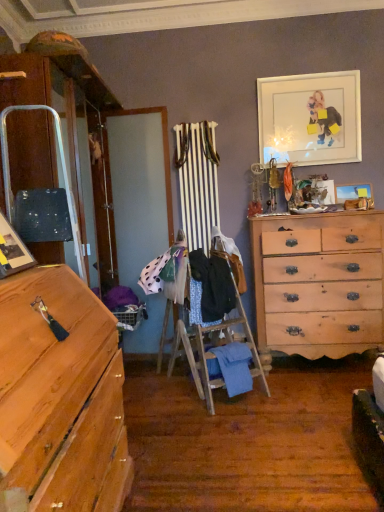
Find the location of `free space above blue cotton blanket at center, which is the fourth clothing in top-to-bottom order (from a real-world perspective)`. free space above blue cotton blanket at center, which is the fourth clothing in top-to-bottom order (from a real-world perspective) is located at coordinates (231, 343).